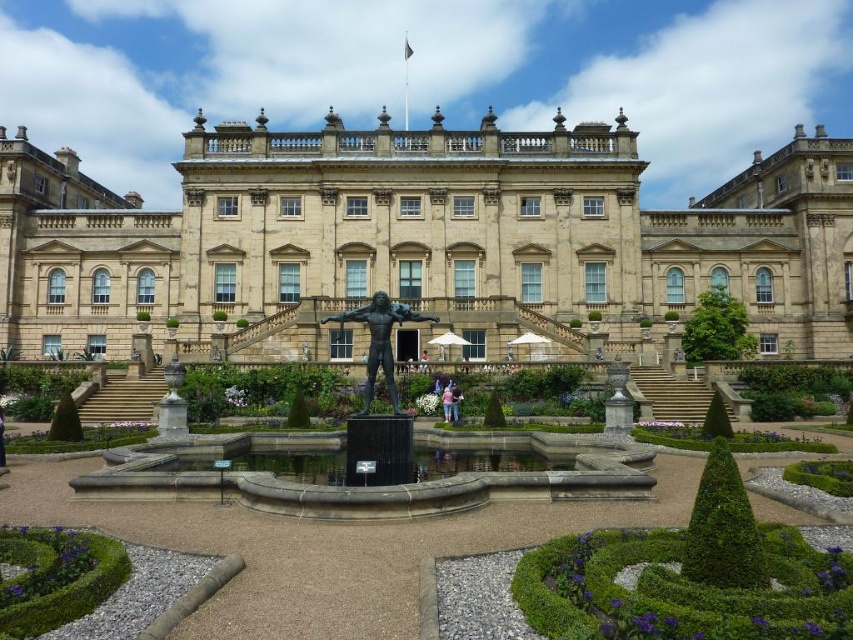
Question: Can you confirm if bronze statue at center is positioned to the right of light blue denim jeans at center?

Choices:
 (A) no
 (B) yes

Answer: (A)

Question: Which point is closer to the camera?

Choices:
 (A) (387, 500)
 (B) (444, 420)
 (C) (451, 406)

Answer: (A)

Question: Is pink fabric person at center further to camera compared to light blue denim jeans at center?

Choices:
 (A) yes
 (B) no

Answer: (B)

Question: Is black polished stone fountain at center below pink fabric person at center?

Choices:
 (A) no
 (B) yes

Answer: (A)

Question: Among these points, which one is farthest from the camera?

Choices:
 (A) (450, 397)
 (B) (407, 320)

Answer: (A)

Question: Among these points, which one is farthest from the camera?

Choices:
 (A) (448, 396)
 (B) (431, 320)
 (C) (457, 394)
 (D) (607, 451)

Answer: (C)